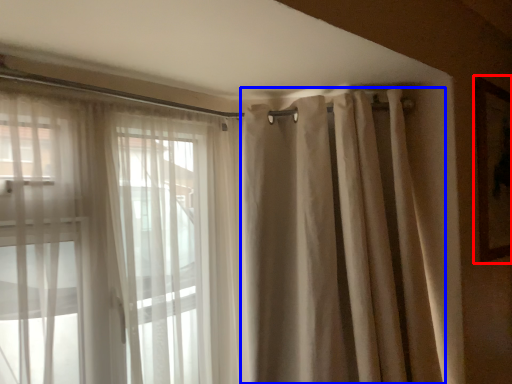
Question: Which point is further to the camera, picture frame (highlighted by a red box) or shower curtain (highlighted by a blue box)?

Choices:
 (A) picture frame
 (B) shower curtain

Answer: (A)